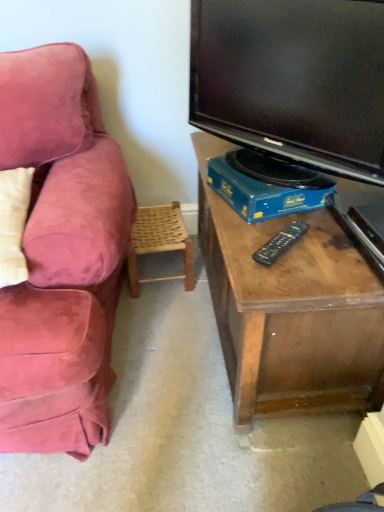
Identify the location of empty space that is ontop of blue cardboard box at lower center (from a real-world perspective). This screenshot has height=512, width=384. (269, 172).